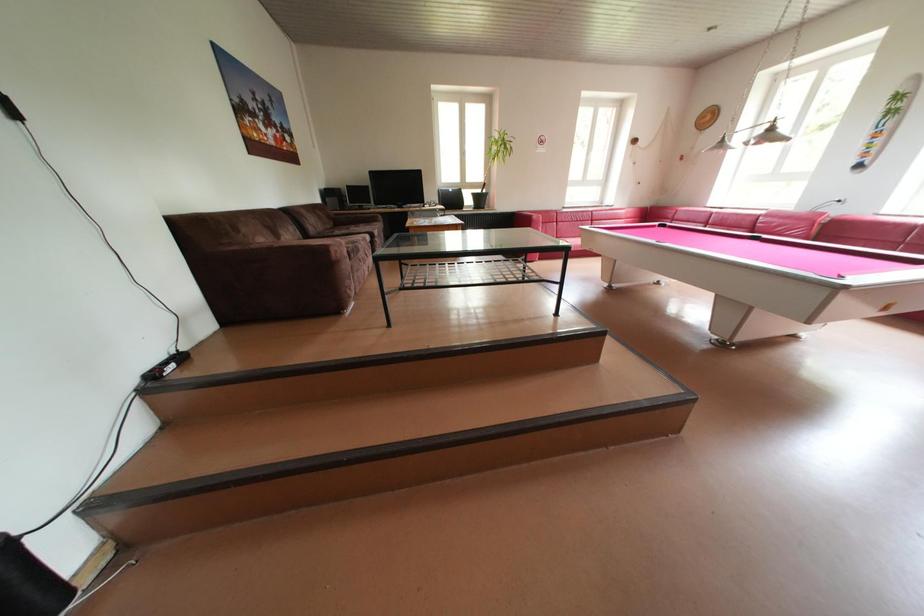
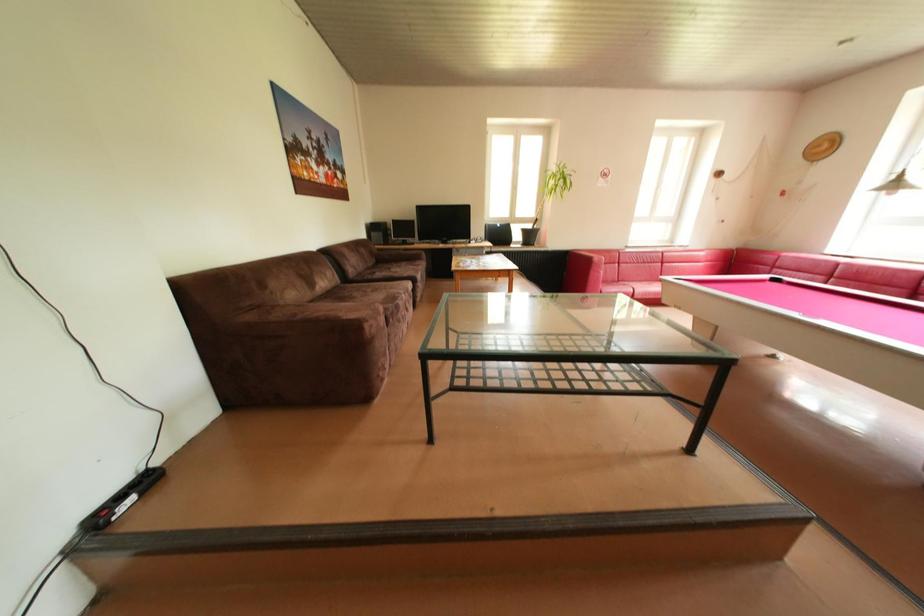
Looking at this image, what movement of the cameraman would produce the second image?

The cameraman moved toward left, forward.